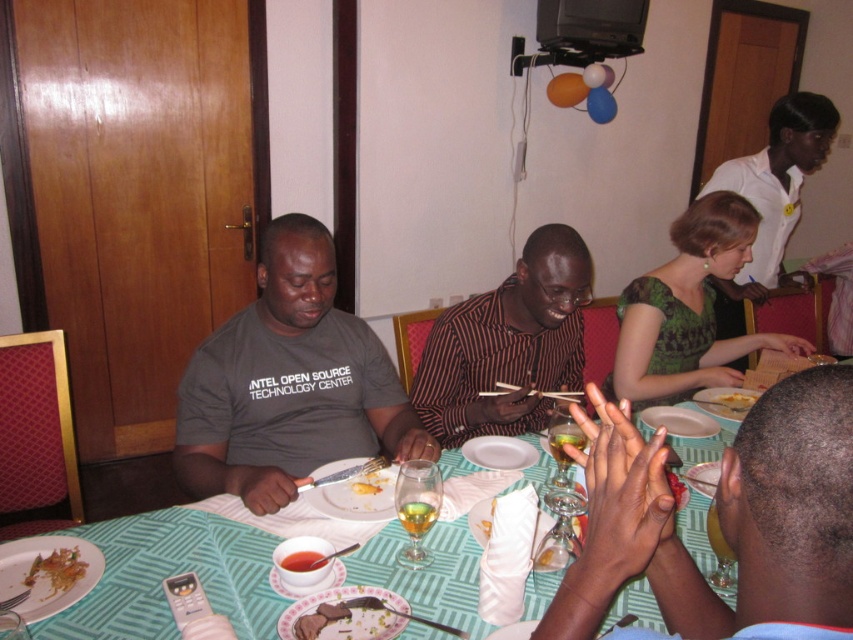
You are a person who is 1.7 meters tall. You want to reach the remote control on the green fabric table at center from your current position. Can you comfortably reach it without moving your feet?

The distance between you and the green fabric table at center is 1.04 meters. Since the average comfortable reaching distance for an adult is about 0.8 to 1.0 meters, you might need to stretch slightly but it should be possible to reach the remote control on the green fabric table at center without moving your feet.

You are a person who wants to pass a napkin from your plate to the person sitting at point [445,436]. The napkin is 0.3 meters away from your plate. Can you reach them without getting up?

The distance between you and the person at point [445,436] is 1.93 meters. Since the napkin is only 0.3 meters away from your plate, you cannot reach them without getting up as the distance is too large.

You are a photographer taking a picture of the dining scene. You need to ensure that both the striped shirt at center and the green matte dress at upper right are clearly visible in the photo. Which one should you focus on first to ensure both are in focus?

The striped shirt at center is in front of the green matte dress at upper right. To ensure both are in focus, you should focus on the striped shirt at center first since it is closer to the camera, and the depth of field will naturally include the background subject.